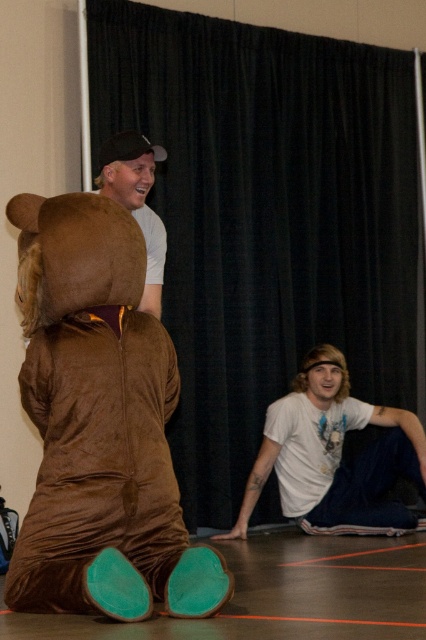
Question: Can you confirm if black velvet curtain at upper center is bigger than matte brown bear at upper left?

Choices:
 (A) no
 (B) yes

Answer: (B)

Question: Which object is farther from the camera taking this photo?

Choices:
 (A) white cotton t-shirt at lower right
 (B) matte brown bear at center

Answer: (A)

Question: Which object is the farthest from the white cotton t-shirt at lower right?

Choices:
 (A) matte brown bear at center
 (B) matte brown bear at upper left
 (C) brown velvety bear at center
 (D) black velvet curtain at upper center

Answer: (C)

Question: Is black velvet curtain at upper center thinner than matte brown bear at center?

Choices:
 (A) no
 (B) yes

Answer: (A)

Question: Which point is farther to the camera?

Choices:
 (A) matte brown bear at center
 (B) matte brown bear at upper left
 (C) brown velvety bear at center

Answer: (A)

Question: Observing the image, what is the correct spatial positioning of white cotton t-shirt at lower right in reference to matte brown bear at upper left?

Choices:
 (A) right
 (B) left

Answer: (A)